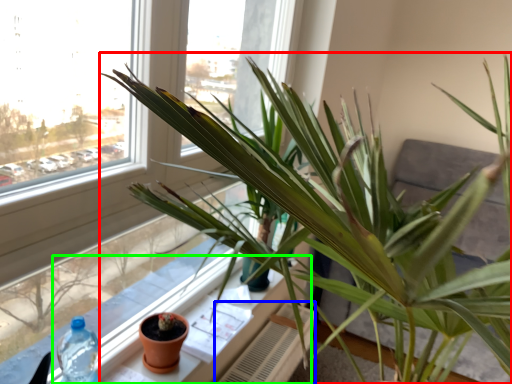
Question: Which object is the farthest from houseplant (highlighted by a red box)? Choose among these: radiator (highlighted by a blue box) or window sill (highlighted by a green box).

Choices:
 (A) radiator
 (B) window sill

Answer: (A)